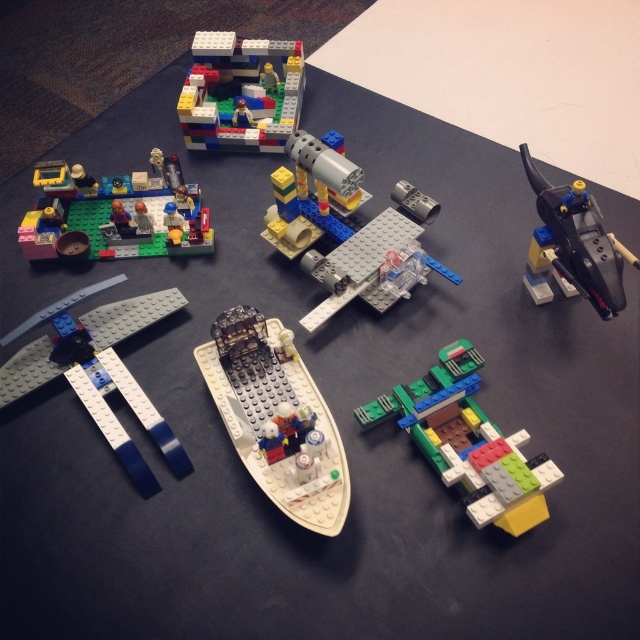
Question: Which object is farther from the camera taking this photo?

Choices:
 (A) multicolored plastic spaceship at lower right
 (B) translucent gray tube at center

Answer: (B)

Question: Observing the image, what is the correct spatial positioning of blue matte airplane wing at lower left in reference to brick-like yellow and red rocket ship at center?

Choices:
 (A) right
 (B) left

Answer: (B)

Question: Which object appears closest to the camera in this image?

Choices:
 (A) blue matte airplane wing at lower left
 (B) brick red plastic building at upper center
 (C) brick-like yellow and red rocket ship at center

Answer: (A)

Question: Which object is farther from the camera taking this photo?

Choices:
 (A) multicolored plastic spaceship at lower right
 (B) translucent gray tube at center
 (C) brick-like yellow and red rocket ship at center
 (D) shiny black spaceship at upper right

Answer: (B)

Question: Is shiny black spaceship at upper right to the right of translucent gray tube at center from the viewer's perspective?

Choices:
 (A) yes
 (B) no

Answer: (A)

Question: Can you confirm if brick green plastic building at upper left is positioned below brick-like yellow and red rocket ship at center?

Choices:
 (A) no
 (B) yes

Answer: (A)